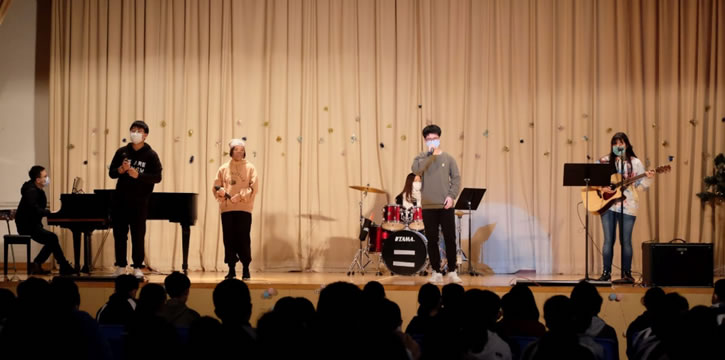
The image size is (725, 360). I want to click on music stands, so click(475, 197), click(581, 172), click(586, 268), click(468, 243).